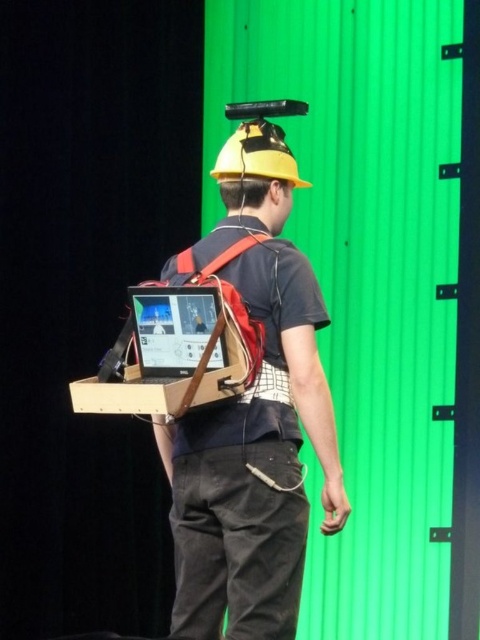
This screenshot has width=480, height=640. What do you see at coordinates (171, 326) in the screenshot? I see `matte black laptop at back` at bounding box center [171, 326].

Which is above, matte black laptop at back or yellow matte hardhat at center?

yellow matte hardhat at center is above.

The image size is (480, 640). What do you see at coordinates (171, 326) in the screenshot? I see `matte black laptop at back` at bounding box center [171, 326].

This screenshot has height=640, width=480. I want to click on matte black laptop at back, so click(171, 326).